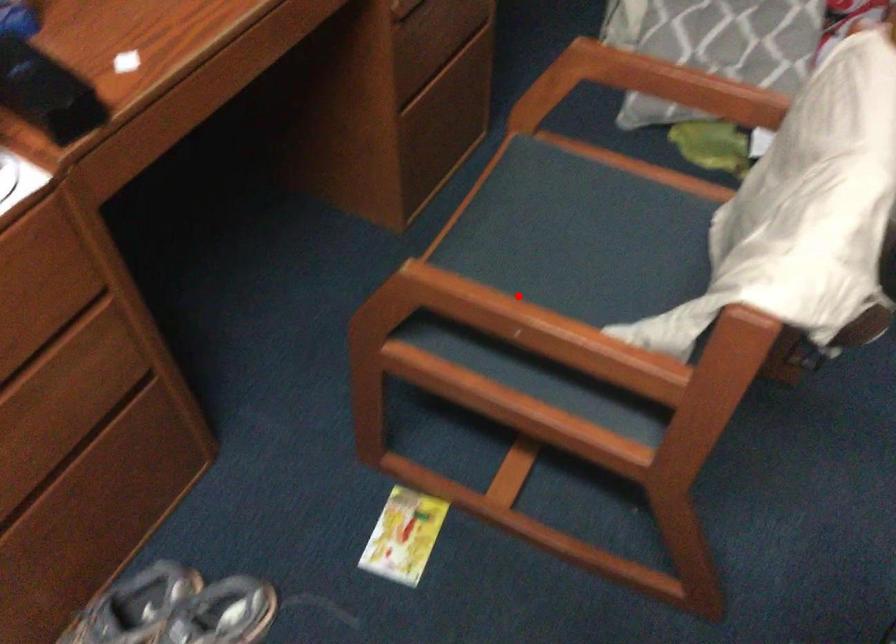
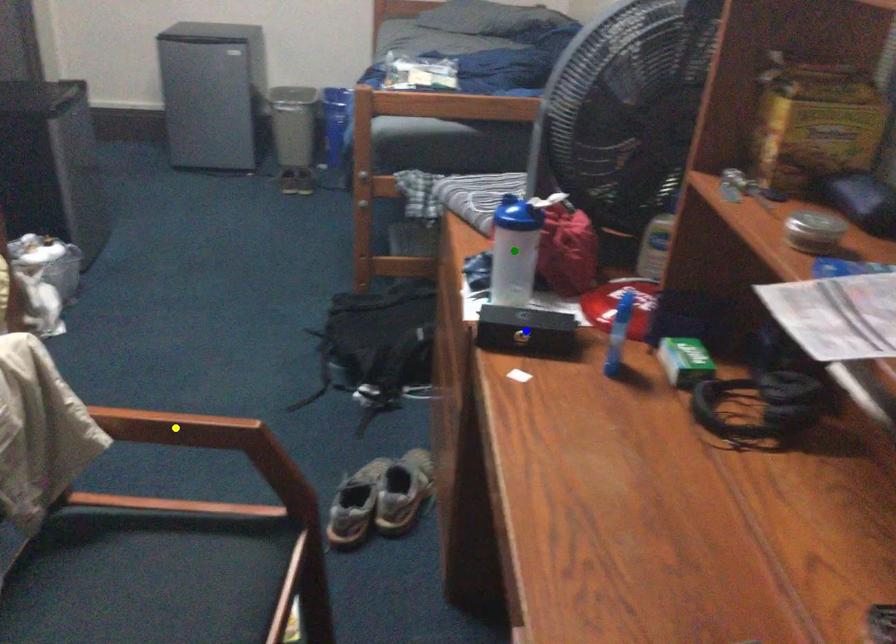
Question: I am providing you with two images of the same scene from different viewpoints. A red point is marked on the first image. You are given multiple points on the second image. Can you choose the point in image 2 that corresponds to the point in image 1?

Choices:
 (A) green point
 (B) blue point
 (C) yellow point

Answer: (C)